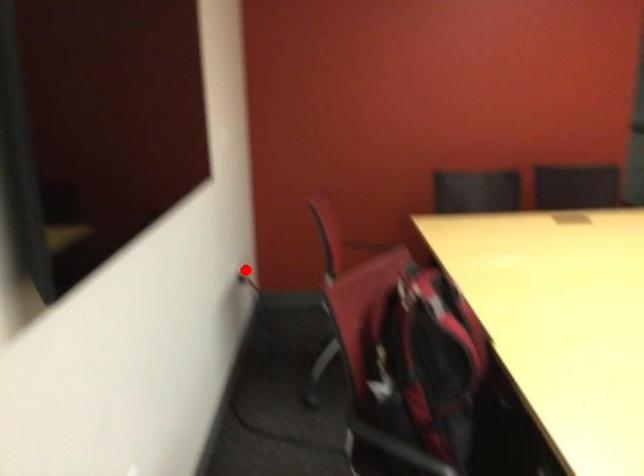
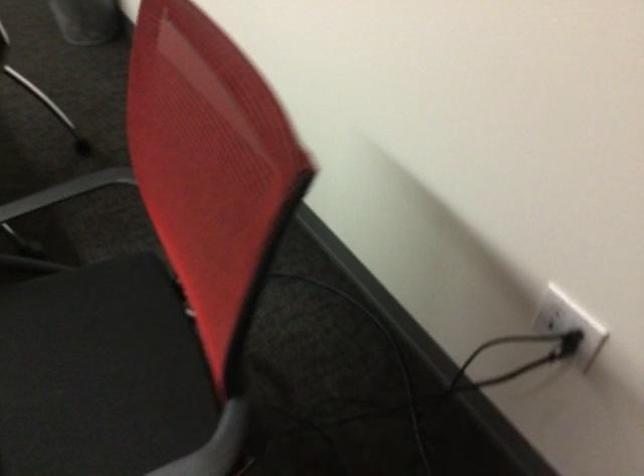
Question: A red point is marked in image1. In image2, is the corresponding 3D point closer to the camera or farther? Reply with the corresponding letter.

Choices:
 (A) The corresponding 3D point is closer.
 (B) The corresponding 3D point is farther.

Answer: (A)